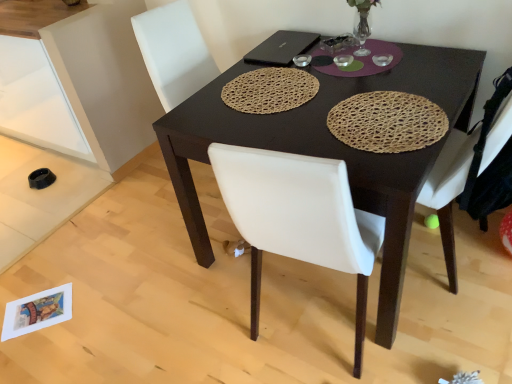
Find the location of a particular element. The image size is (512, 384). vacant area that lies between white leather chair at right and dark brown wooden desk at center is located at coordinates (438, 298).